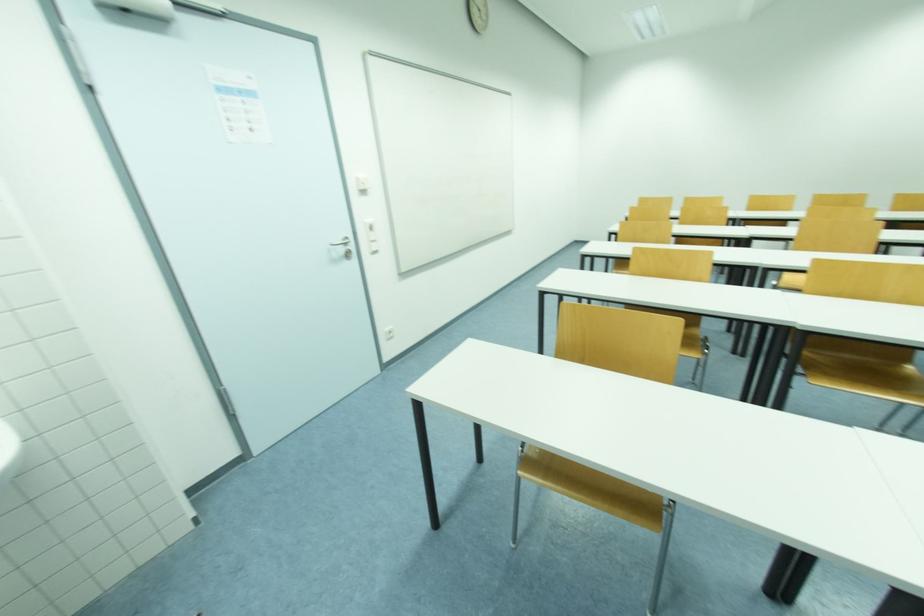
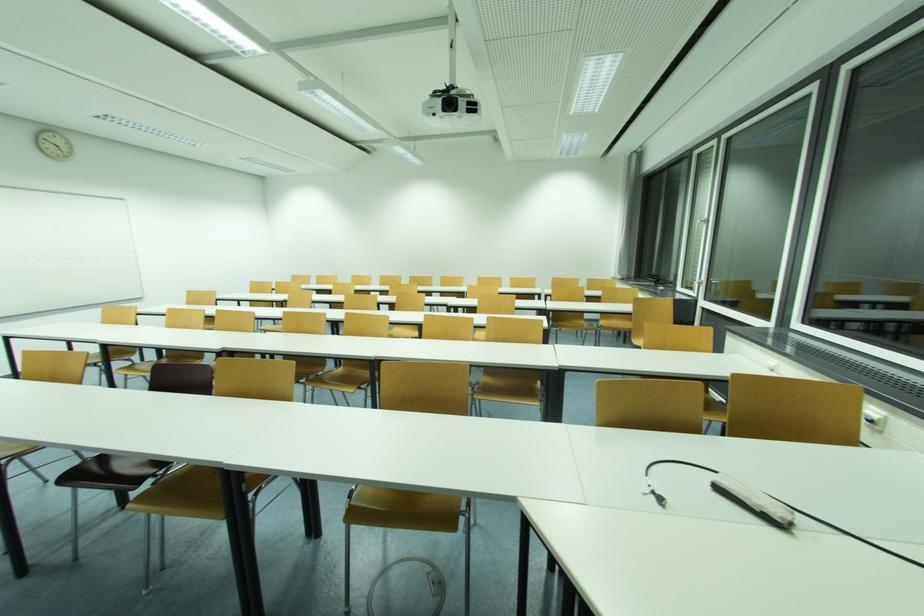
In a continuous first-person perspective shot, in which direction is the camera moving?

The movement direction of the cameraman is right, backward.